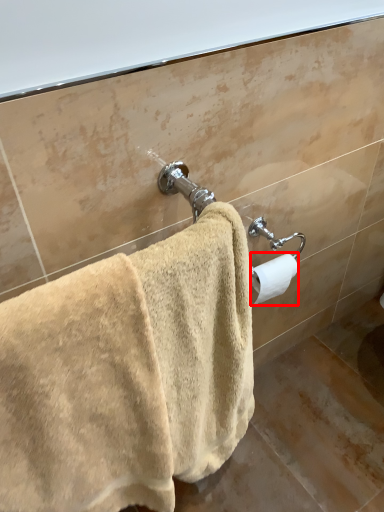
Question: Observing the image, what is the correct spatial positioning of toilet paper (annotated by the red box) in reference to towel?

Choices:
 (A) right
 (B) left

Answer: (A)